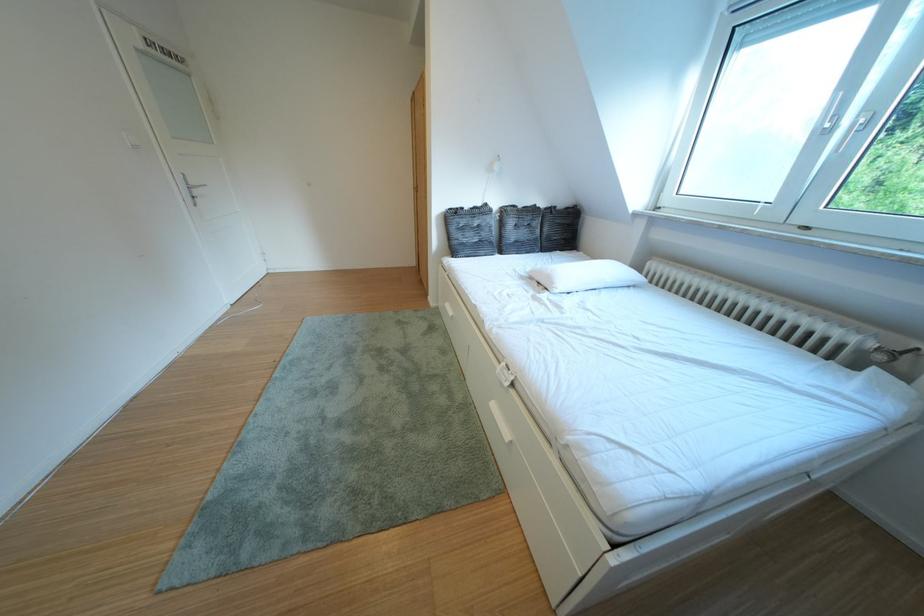
This screenshot has height=616, width=924. Find the location of `radiator valve`. radiator valve is located at coordinates (894, 354).